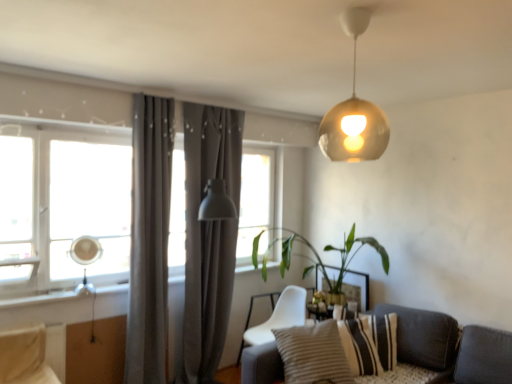
Question: Is matte gray curtain at center, which is the first curtain in back-to-front order, inside or outside of white fabric chair at lower center?

Choices:
 (A) inside
 (B) outside

Answer: (B)

Question: Is matte gray curtain at center, which is the first curtain in back-to-front order, in front of or behind white fabric chair at lower center in the image?

Choices:
 (A) behind
 (B) front

Answer: (B)

Question: Which object is the closest to the gold metallic sphere at upper center?

Choices:
 (A) matte silver table lamp at left
 (B) green leafy plant at center
 (C) textured gray couch at lower right
 (D) matte gray curtain at center, which is counted as the 2th curtain, starting from the front
 (E) striped fabric pillow at lower right, which is the first pillow in front-to-back order

Answer: (E)

Question: Which object is the closest to the green leafy plant at center?

Choices:
 (A) striped fabric pillow at lower right, the second pillow positioned from the back
 (B) gray fabric curtain at left, which ranks as the 1th curtain in front-to-back order
 (C) gold metallic sphere at upper center
 (D) transparent glass window at left
 (E) beige fabric swivel chair at lower left

Answer: (A)